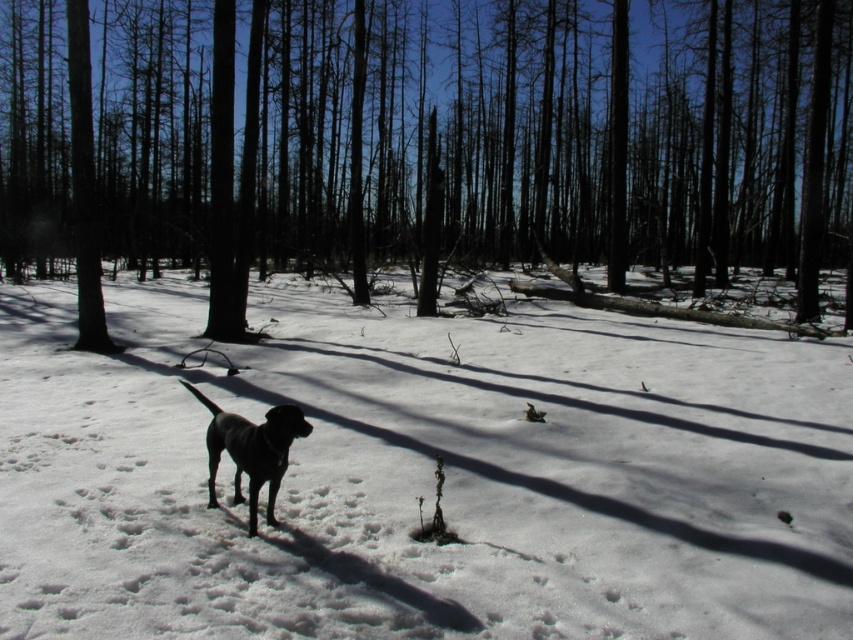
You are planning to build a snowman using the white powdery snow at center and want to place the shiny black dog at center nearby. Given the size of the snowman and the dog, will the snowman be larger than the dog?

The white powdery snow at center is bigger than shiny black dog at center, so the snowman made from the white powdery snow at center will be larger than the shiny black dog at center.

You are a hiker trying to find the best path through the forest. You see the white powdery snow at center and the brown wood tree at center. Which object is closer to the ground?

The white powdery snow at center is located below brown wood tree at center, so it is closer to the ground.

You are a photographer trying to capture the perfect shot of the winter forest scene. You notice two points in the image labeled as point (194, 566) and point (271, 428). Which point should you focus on if you want to highlight the foreground elements in your photo?

Point (194, 566) should be focused on because it is closer to the camera, making it ideal for highlighting foreground elements in the winter forest scene.